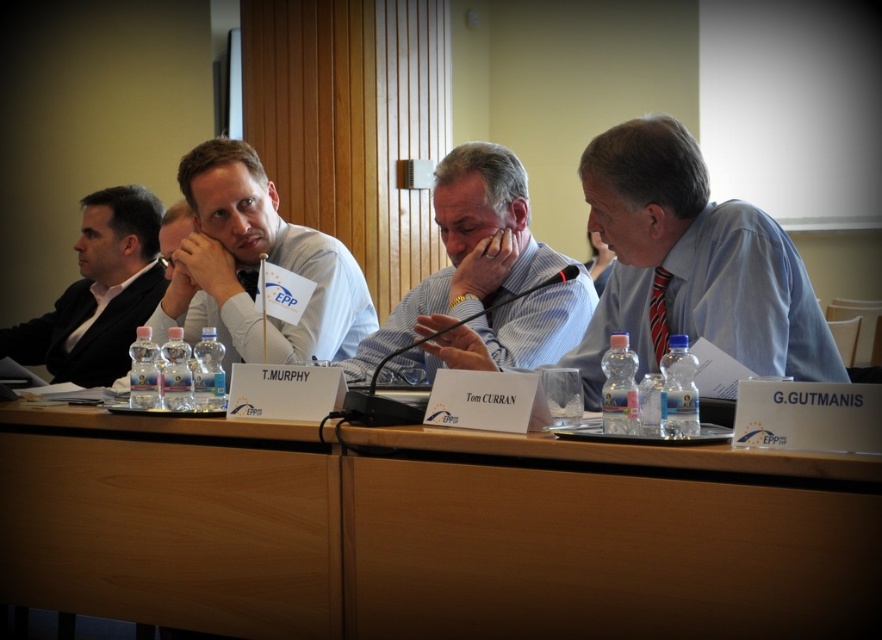
Does blue striped shirt at center appear under black suit at left?

Correct, blue striped shirt at center is located below black suit at left.

At what (x,y) coordinates should I click in order to perform the action: click on blue striped shirt at center. Please return your answer as a coordinate pair (x, y). Looking at the image, I should click on (487, 269).

The image size is (882, 640). In order to click on blue striped shirt at center in this screenshot , I will do `click(487, 269)`.

Based on the photo, can you confirm if brown wood table at center is positioned below white shirt at center?

Correct, brown wood table at center is located below white shirt at center.

Is point (117, 444) farther from viewer compared to point (266, 259)?

No, (117, 444) is closer to viewer.

Is point (35, 461) closer to viewer compared to point (320, 291)?

Yes, point (35, 461) is closer to viewer.

The image size is (882, 640). I want to click on brown wood table at center, so click(430, 531).

Between white shirt at center and blue striped shirt at center, which one has more height?

With more height is white shirt at center.

Who is higher up, white shirt at center or blue striped shirt at center?

blue striped shirt at center is higher up.

What do you see at coordinates (256, 266) in the screenshot? This screenshot has height=640, width=882. I see `white shirt at center` at bounding box center [256, 266].

At what (x,y) coordinates should I click in order to perform the action: click on white shirt at center. Please return your answer as a coordinate pair (x, y). Image resolution: width=882 pixels, height=640 pixels. Looking at the image, I should click on (256, 266).